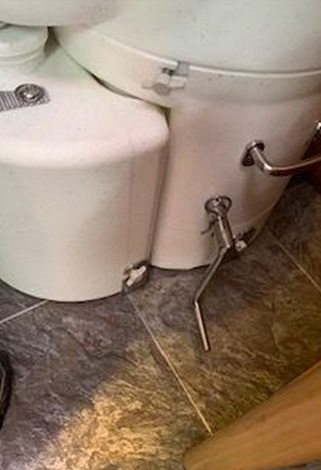
Locate an element on the screen. silver handle is located at coordinates (200, 328).